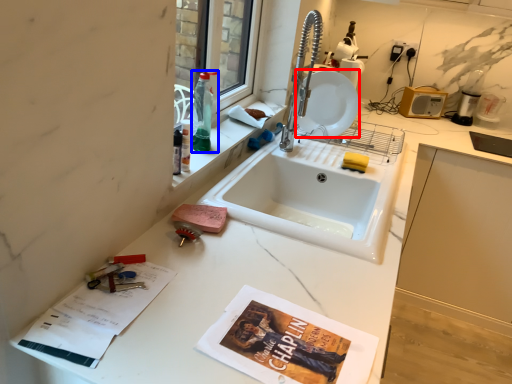
Question: Which object is further to the camera taking this photo, plate (highlighted by a red box) or bottle (highlighted by a blue box)?

Choices:
 (A) plate
 (B) bottle

Answer: (A)